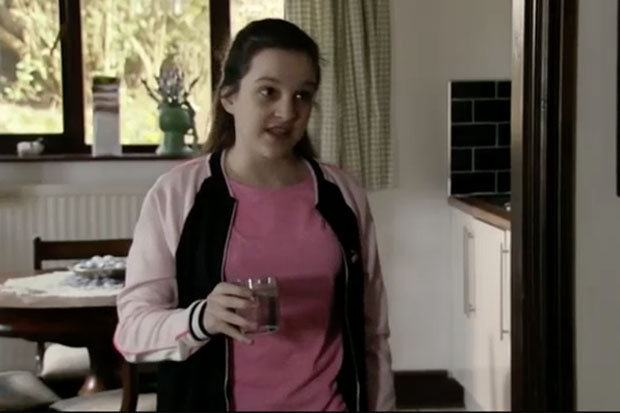
Identify the location of window. The image size is (620, 413). (244, 7), (170, 20), (30, 20).